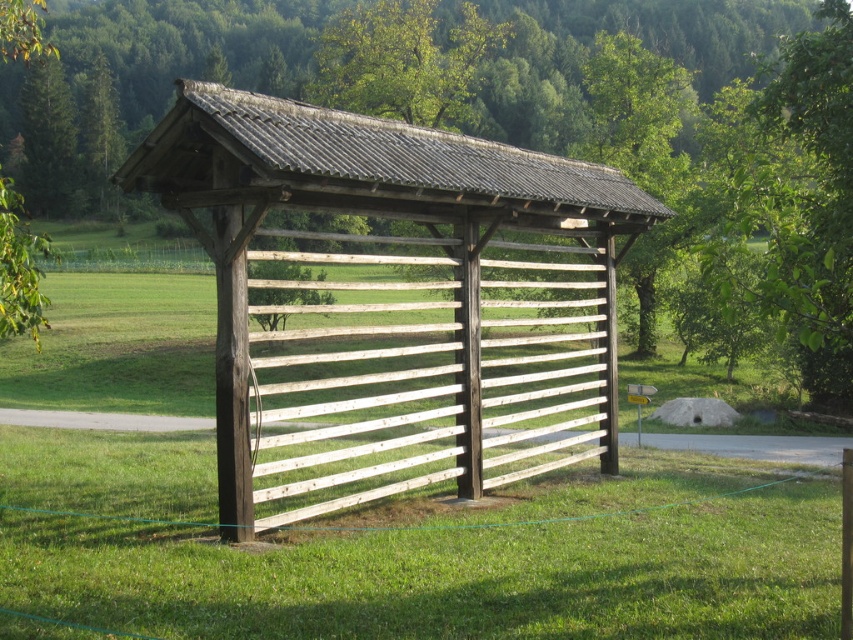
Question: Which point appears farthest from the camera in this image?

Choices:
 (A) (469, 362)
 (B) (809, 554)
 (C) (759, 40)

Answer: (C)

Question: Which point is farther from the camera taking this photo?

Choices:
 (A) (625, 8)
 (B) (322, 458)
 (C) (68, 579)

Answer: (A)

Question: Is wooden slats at center to the left of green leafy tree at center from the viewer's perspective?

Choices:
 (A) yes
 (B) no

Answer: (B)

Question: Which is farther from the wooden slats at center?

Choices:
 (A) green grass at center
 (B) green leafy tree at center

Answer: (B)

Question: Is green grass at center bigger than wooden slats at center?

Choices:
 (A) yes
 (B) no

Answer: (B)

Question: From the image, what is the correct spatial relationship of green grass at center in relation to wooden slats at center?

Choices:
 (A) left
 (B) right

Answer: (A)